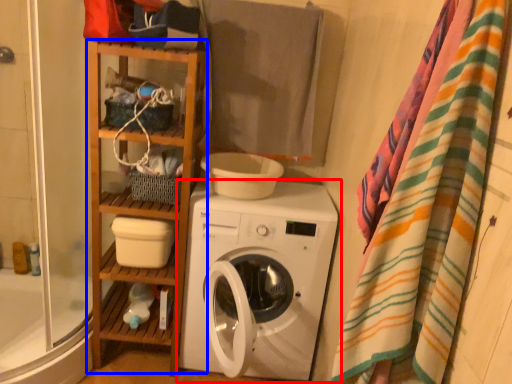
Question: Which point is closer to the camera, washing machine (highlighted by a red box) or cabinet (highlighted by a blue box)?

Choices:
 (A) washing machine
 (B) cabinet

Answer: (A)